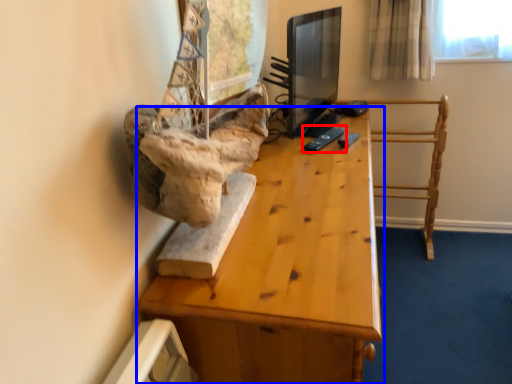
Question: Which object is closer to the camera taking this photo, remote (highlighted by a red box) or table (highlighted by a blue box)?

Choices:
 (A) remote
 (B) table

Answer: (B)